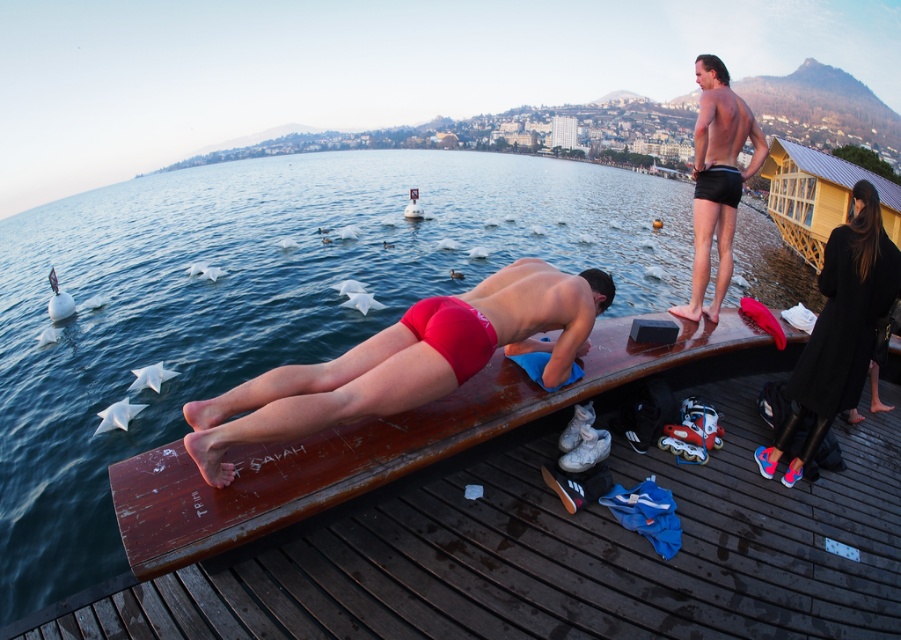
Question: Which object is farther from the camera taking this photo?

Choices:
 (A) black leather pants at right
 (B) smooth black dress at upper right
 (C) wooden dock at center

Answer: (A)

Question: Is smooth black dress at upper right further to the viewer compared to black leather pants at right?

Choices:
 (A) no
 (B) yes

Answer: (A)

Question: Which of the following is the closest to the observer?

Choices:
 (A) (307, 364)
 (B) (260, 253)
 (C) (724, 230)
 (D) (799, 449)

Answer: (A)

Question: Does wooden dock at center appear on the right side of shiny black shorts at upper right?

Choices:
 (A) yes
 (B) no

Answer: (B)

Question: Is smooth black dress at upper right thinner than shiny black shorts at upper right?

Choices:
 (A) yes
 (B) no

Answer: (A)

Question: Which of the following is the farthest from the observer?

Choices:
 (A) (719, 224)
 (B) (845, 346)
 (C) (275, 202)

Answer: (C)